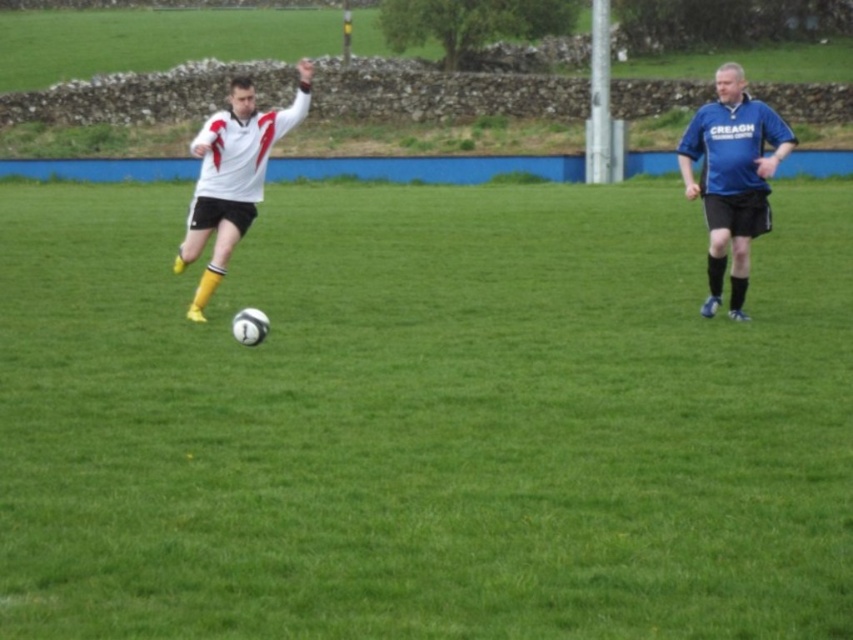
Question: Where is white matte soccer ball at center located in relation to white matte jersey at center in the image?

Choices:
 (A) right
 (B) left

Answer: (A)

Question: Which point is closer to the camera taking this photo?

Choices:
 (A) (184, 252)
 (B) (415, 593)

Answer: (B)

Question: Is blue jersey at right thinner than white matte jersey at center?

Choices:
 (A) no
 (B) yes

Answer: (B)

Question: Which object is the farthest from the white matte jersey at center?

Choices:
 (A) blue jersey at right
 (B) white matte soccer ball at center

Answer: (A)

Question: Which point appears closest to the camera in this image?

Choices:
 (A) pyautogui.click(x=245, y=145)
 (B) pyautogui.click(x=758, y=228)
 (C) pyautogui.click(x=326, y=192)

Answer: (B)

Question: Does blue jersey at right appear over white matte jersey at center?

Choices:
 (A) no
 (B) yes

Answer: (A)